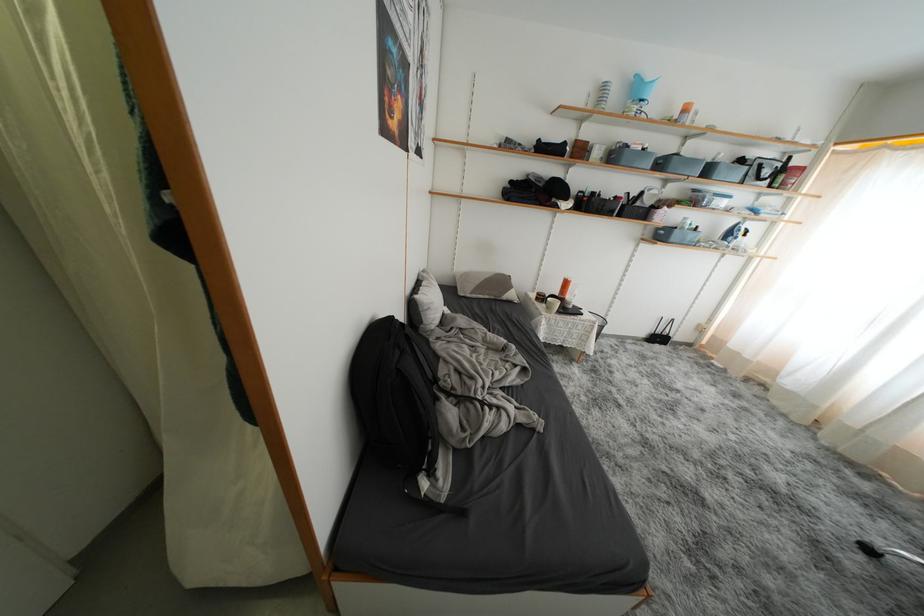
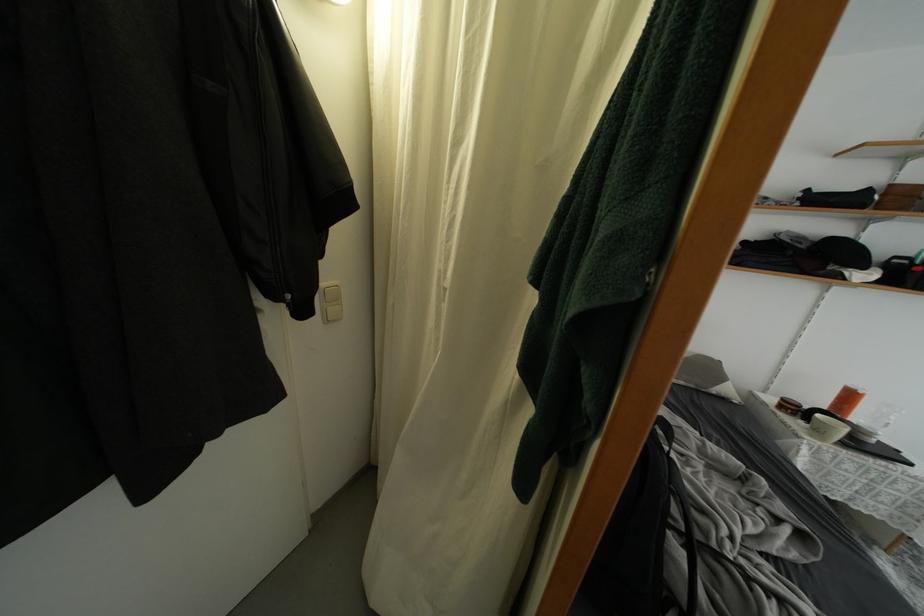
The point at (519, 351) is marked in the first image. Where is the corresponding point in the second image?

(769, 485)